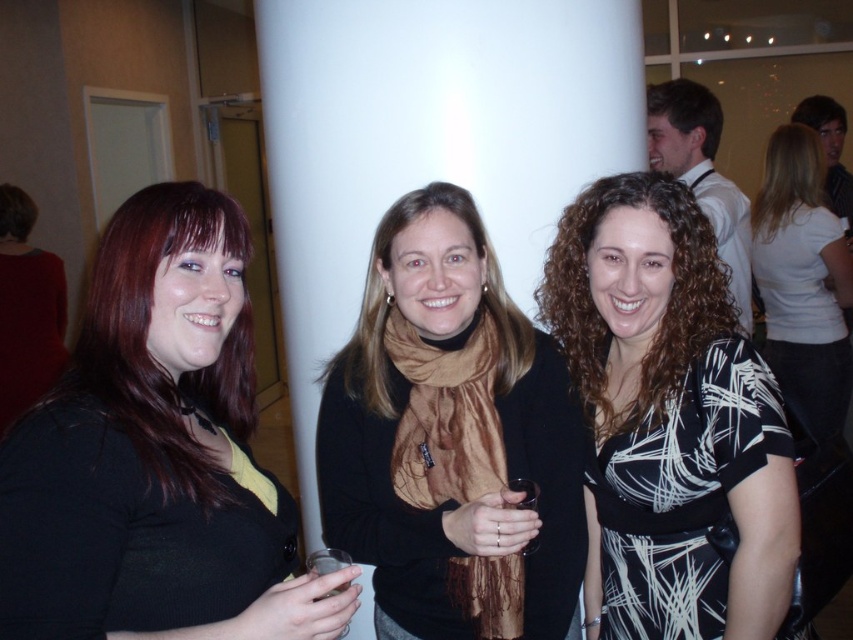
Question: Which point is farther from the camera taking this photo?

Choices:
 (A) (280, 630)
 (B) (686, 106)

Answer: (B)

Question: From the image, what is the correct spatial relationship of matte black sweater at left in relation to white matte shirt at upper right?

Choices:
 (A) right
 (B) left

Answer: (B)

Question: Among these points, which one is farthest from the camera?

Choices:
 (A) (376, 598)
 (B) (695, 112)
 (C) (645, 200)
 (D) (253, 424)

Answer: (B)

Question: Which point is farther from the camera taking this photo?

Choices:
 (A) (196, 371)
 (B) (149, 429)
 (C) (560, 481)
 (D) (637, 529)

Answer: (C)

Question: Can you confirm if matte black sweater at left is thinner than matte black hair at left?

Choices:
 (A) no
 (B) yes

Answer: (A)

Question: Does matte black hair at left lie in front of brown hair at center?

Choices:
 (A) no
 (B) yes

Answer: (B)